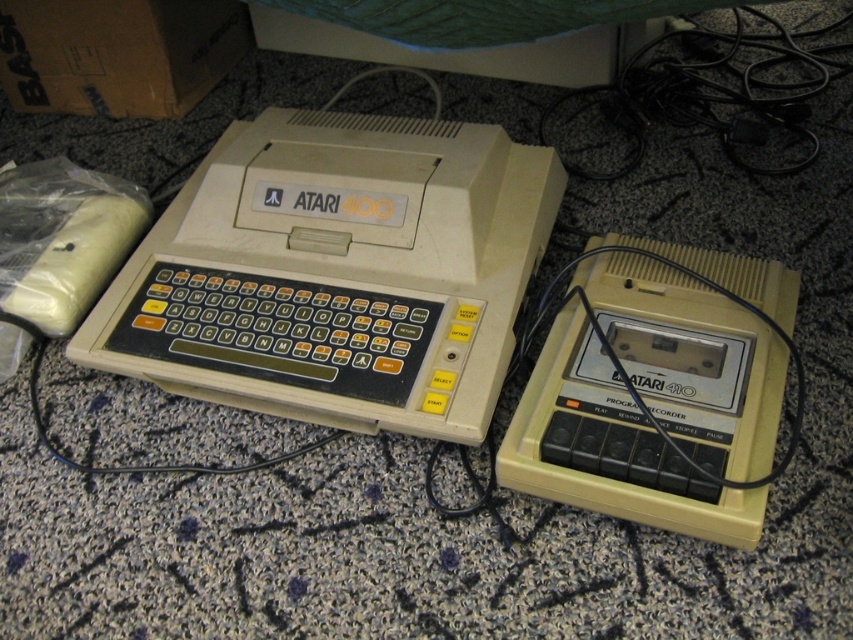
Between beige plastic atari 400 at center and beige plastic atari 410 at right, which one is positioned higher?

beige plastic atari 400 at center is higher up.

Does beige plastic atari 400 at center have a lesser width compared to beige plastic atari 410 at right?

No, beige plastic atari 400 at center is not thinner than beige plastic atari 410 at right.

Find the location of a particular element. The width and height of the screenshot is (853, 640). beige plastic atari 400 at center is located at coordinates (337, 273).

At what (x,y) coordinates should I click in order to perform the action: click on beige plastic atari 400 at center. Please return your answer as a coordinate pair (x, y). Image resolution: width=853 pixels, height=640 pixels. Looking at the image, I should click on (337, 273).